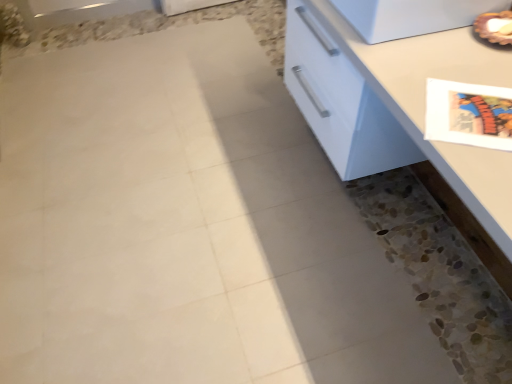
Identify the location of empty space that is ontop of white glossy countertop at right. [453, 78].